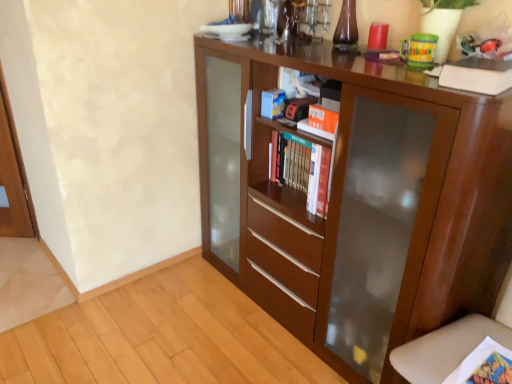
Question: Are hardcover books at center and brown wood cupboard at center located far from each other?

Choices:
 (A) no
 (B) yes

Answer: (A)

Question: Is hardcover books at center further to the viewer compared to brown wood cupboard at center?

Choices:
 (A) no
 (B) yes

Answer: (B)

Question: Does hardcover books at center have a larger size compared to brown wood cupboard at center?

Choices:
 (A) no
 (B) yes

Answer: (A)

Question: Can you confirm if hardcover books at center is smaller than brown wood cupboard at center?

Choices:
 (A) no
 (B) yes

Answer: (B)

Question: Could you tell me if hardcover books at center is turned towards brown wood cupboard at center?

Choices:
 (A) no
 (B) yes

Answer: (B)

Question: Does point (307, 180) appear closer or farther from the camera than point (411, 201)?

Choices:
 (A) closer
 (B) farther

Answer: (B)

Question: From the image's perspective, is hardcover books at center positioned above or below brown wood cupboard at center?

Choices:
 (A) above
 (B) below

Answer: (A)

Question: Visually, is hardcover books at center positioned to the left or to the right of brown wood cupboard at center?

Choices:
 (A) right
 (B) left

Answer: (B)

Question: Considering the positions of hardcover books at center and brown wood cupboard at center in the image, is hardcover books at center taller or shorter than brown wood cupboard at center?

Choices:
 (A) short
 (B) tall

Answer: (A)

Question: Considering the positions of hardcover books at center and white matte book at upper right in the image, is hardcover books at center wider or thinner than white matte book at upper right?

Choices:
 (A) wide
 (B) thin

Answer: (B)

Question: Is hardcover books at center situated inside white matte book at upper right or outside?

Choices:
 (A) outside
 (B) inside

Answer: (A)

Question: In terms of height, does hardcover books at center look taller or shorter compared to white matte book at upper right?

Choices:
 (A) short
 (B) tall

Answer: (B)

Question: From the image's perspective, is hardcover books at center above or below white matte book at upper right?

Choices:
 (A) below
 (B) above

Answer: (A)

Question: From the image's perspective, relative to brown wood cupboard at center, is white matte book at upper right above or below?

Choices:
 (A) above
 (B) below

Answer: (A)

Question: Is white matte book at upper right inside or outside of brown wood cupboard at center?

Choices:
 (A) outside
 (B) inside

Answer: (A)